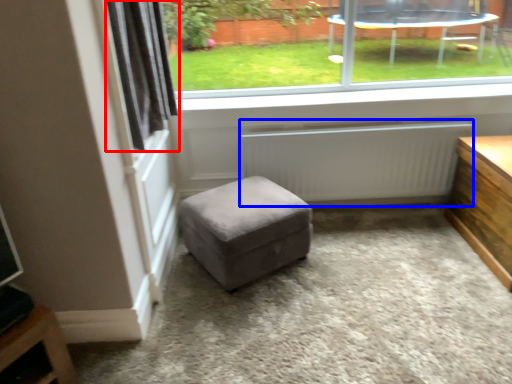
Question: Which of the following is the farthest to the observer, curtain (highlighted by a red box) or radiator (highlighted by a blue box)?

Choices:
 (A) curtain
 (B) radiator

Answer: (B)